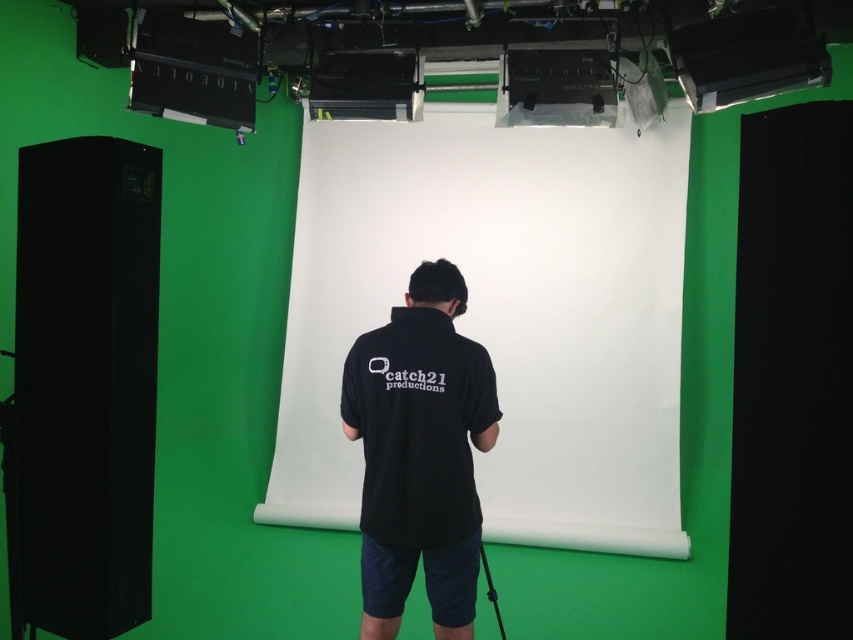
The width and height of the screenshot is (853, 640). In order to click on white matte projection screen at center in this screenshot , I will do `click(502, 314)`.